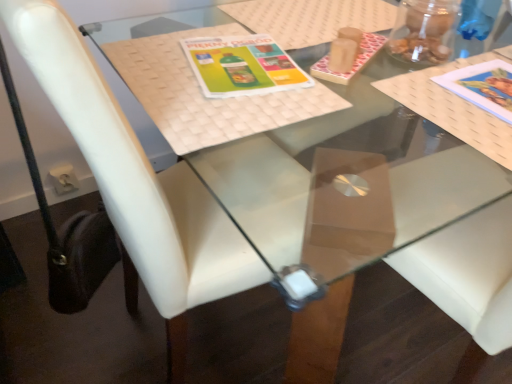
Question: Considering the relative sizes of white leather chair at center and matte paper book at upper right, which ranks as the 1th book cover in right-to-left order, in the image provided, is white leather chair at center taller than matte paper book at upper right, which ranks as the 1th book cover in right-to-left order,?

Choices:
 (A) yes
 (B) no

Answer: (A)

Question: Can you see white leather chair at center touching matte paper book at upper right, which ranks as the 1th book cover in right-to-left order?

Choices:
 (A) yes
 (B) no

Answer: (B)

Question: Considering the relative sizes of white leather chair at center and matte paper book at upper right, which ranks as the 1th book cover in right-to-left order, in the image provided, is white leather chair at center smaller than matte paper book at upper right, which ranks as the 1th book cover in right-to-left order,?

Choices:
 (A) no
 (B) yes

Answer: (A)

Question: Is white leather chair at center facing away from matte paper book at upper right, which ranks as the 1th book cover in right-to-left order?

Choices:
 (A) no
 (B) yes

Answer: (A)

Question: Does white leather chair at center turn towards matte paper book at upper right, which ranks as the 1th book cover in right-to-left order?

Choices:
 (A) no
 (B) yes

Answer: (A)

Question: From the image's perspective, relative to matte paper book at upper right, which ranks as the 1th book cover in right-to-left order, is white leather chair at center above or below?

Choices:
 (A) below
 (B) above

Answer: (A)

Question: Is white leather chair at center inside the boundaries of matte paper book at upper right, which appears as the 2th book cover when viewed from the left, or outside?

Choices:
 (A) inside
 (B) outside

Answer: (B)

Question: Relative to matte paper book at upper right, which appears as the 2th book cover when viewed from the left, is white leather chair at center in front or behind?

Choices:
 (A) behind
 (B) front

Answer: (B)

Question: Is white leather chair at center taller or shorter than matte paper book at upper right, which ranks as the 1th book cover in right-to-left order?

Choices:
 (A) tall
 (B) short

Answer: (A)

Question: In terms of height, does matte green plastic book cover at center, placed as the 2th book cover when sorted from right to left, look taller or shorter compared to white leather chair at center?

Choices:
 (A) short
 (B) tall

Answer: (A)

Question: From a real-world perspective, relative to white leather chair at center, is matte green plastic book cover at center, the first book cover viewed from the left, vertically above or below?

Choices:
 (A) below
 (B) above

Answer: (B)

Question: From the image's perspective, is matte green plastic book cover at center, the first book cover viewed from the left, above or below white leather chair at center?

Choices:
 (A) above
 (B) below

Answer: (A)

Question: Is point (223, 66) closer or farther from the camera than point (164, 213)?

Choices:
 (A) closer
 (B) farther

Answer: (B)

Question: From the image's perspective, relative to matte paper book at upper right, which ranks as the 1th book cover in right-to-left order, is matte green plastic book cover at center, placed as the 2th book cover when sorted from right to left, above or below?

Choices:
 (A) above
 (B) below

Answer: (A)

Question: In terms of height, does matte green plastic book cover at center, placed as the 2th book cover when sorted from right to left, look taller or shorter compared to matte paper book at upper right, which ranks as the 1th book cover in right-to-left order?

Choices:
 (A) short
 (B) tall

Answer: (A)